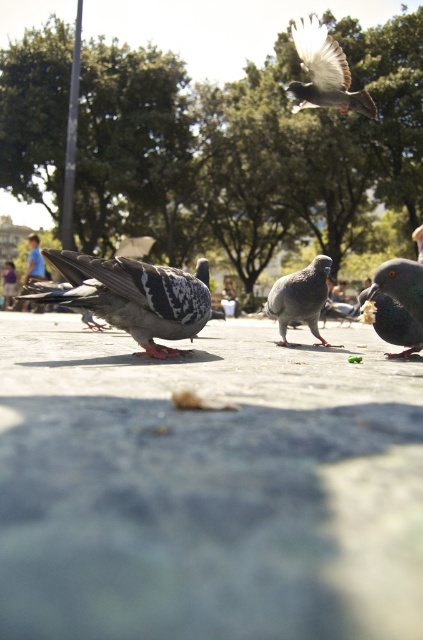
You are a birdwatcher trying to observe the speckled feathered pigeon at center from the gray concrete pavement at center. Can you stand on the pavement and see the pigeon clearly without any obstruction?

The gray concrete pavement at center is shorter than the speckled feathered pigeon at center, so yes, you can stand on the pavement and see the pigeon clearly without any obstruction since the pigeon is taller than the pavement.